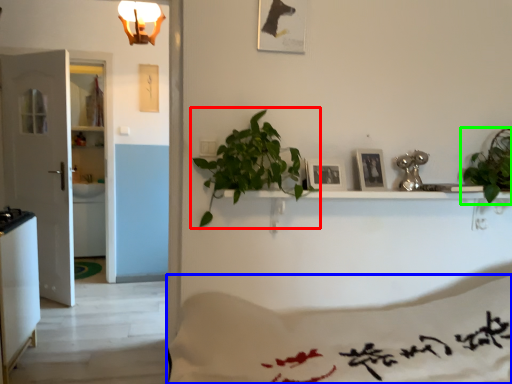
Question: Based on their relative distances, which object is nearer to houseplant (highlighted by a red box)? Choose from sheet (highlighted by a blue box) and houseplant (highlighted by a green box).

Choices:
 (A) sheet
 (B) houseplant

Answer: (A)